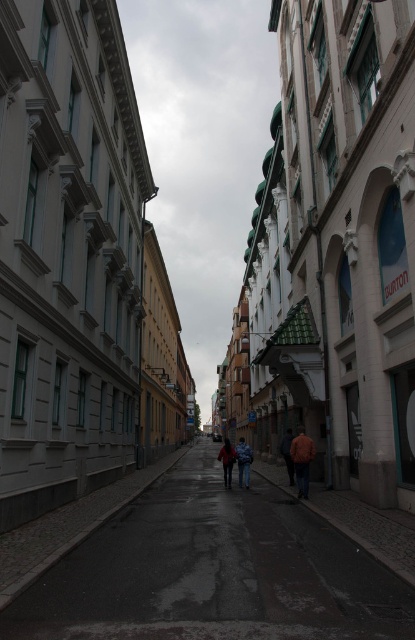
You are a pedestrian standing on the wet street in the image. You see a blue denim jacket at center and an orange fabric jacket at center. Which jacket is positioned closer to your left side?

The blue denim jacket at center is positioned to the left of the orange fabric jacket at center, so it is closer to your left side.

You are a pedestrian standing on the dark asphalt road at center. You see an orange leather jacket at center above you. What is directly above you on the street?

The orange leather jacket at center is directly above you on the street because it is positioned above the dark asphalt road at center according to the description.

You are a pedestrian standing on the dark asphalt road at center and want to reach the orange leather jacket at center. Which direction should you move to get closer to the jacket?

The dark asphalt road at center is positioned on the left side of the orange leather jacket at center, so you should move to the right to get closer to the jacket.